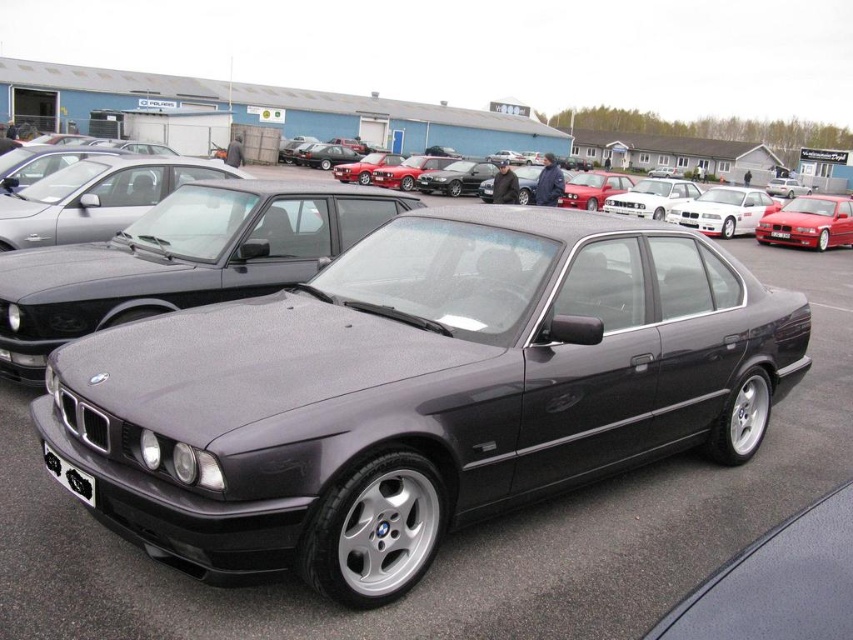
You are a photographer trying to capture a clear shot of the satin black car at center and the black plastic license plate at center. Since you want to focus on the car, which object should you zoom in on more to make sure it takes up most of the frame?

The satin black car at center is larger in size than the black plastic license plate at center, so you should zoom in on the satin black car at center to ensure it takes up most of the frame.

You are standing at the center of the parking lot and see the dark gray BMW sedan in the foreground and the metallic red sedan at right. Which car is closer to the point marked at coordinates (809, 221)?

The metallic red sedan at right is located at point (809, 221), so it is exactly at that coordinate point, making it the closest to the specified point.

You are standing at the center of the parking lot and see the dark gray BMW sedan in the foreground and the metallic red sedan at right. Which car is closer to you?

The dark gray BMW sedan in the foreground is closer to you than the metallic red sedan at right.